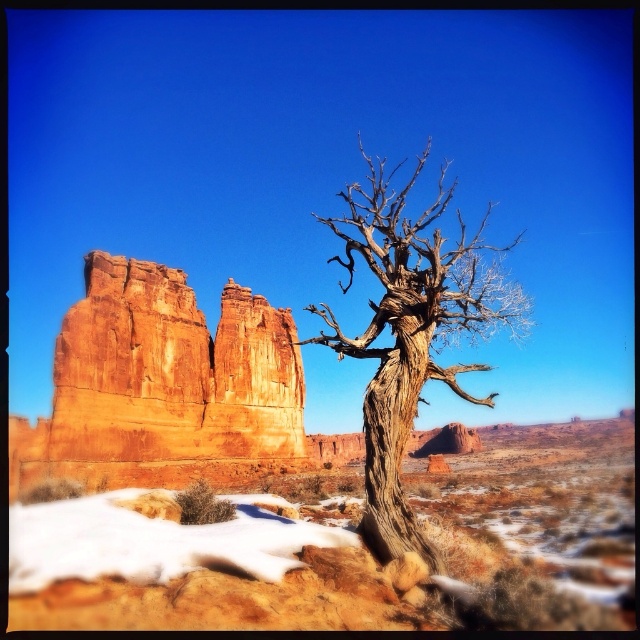
Can you confirm if desert sandstone rock at center is positioned to the left of white powdery snow at lower left?

In fact, desert sandstone rock at center is to the right of white powdery snow at lower left.

Is point (616, 621) farther from camera compared to point (252, 520)?

No, (616, 621) is in front of (252, 520).

Which is in front, point (88, 572) or point (28, 564)?

Point (28, 564) is more forward.

At what (x,y) coordinates should I click in order to perform the action: click on desert sandstone rock at center. Please return your answer as a coordinate pair (x, y). The height and width of the screenshot is (640, 640). Looking at the image, I should click on (348, 547).

Looking at this image, between grayish-brown bark tree at center and white powdery snow at lower left, which one appears on the right side from the viewer's perspective?

Positioned to the right is grayish-brown bark tree at center.

Based on the photo, can you confirm if grayish-brown bark tree at center is positioned to the right of white powdery snow at lower left?

Indeed, grayish-brown bark tree at center is positioned on the right side of white powdery snow at lower left.

Measure the distance between point [412,513] and camera.

Point [412,513] and camera are 179.70 feet apart from each other.

Locate an element on the screen. The width and height of the screenshot is (640, 640). grayish-brown bark tree at center is located at coordinates (412, 330).

Does desert sandstone rock at center have a smaller size compared to rustic sandstone rock formation at left?

No, desert sandstone rock at center is not smaller than rustic sandstone rock formation at left.

Describe the element at coordinates (348, 547) in the screenshot. I see `desert sandstone rock at center` at that location.

Find the location of a particular element. The height and width of the screenshot is (640, 640). desert sandstone rock at center is located at coordinates (348, 547).

Identify the location of desert sandstone rock at center. (348, 547).